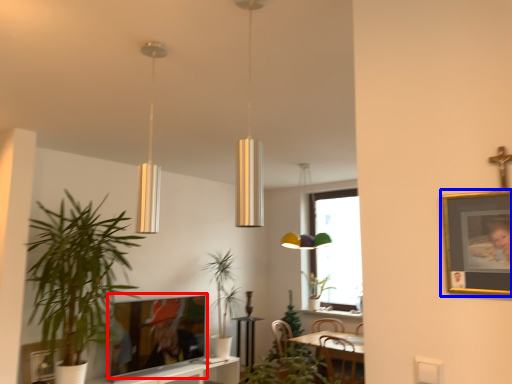
Question: Which of the following is the closest to the observer, picture frame (highlighted by a red box) or picture frame (highlighted by a blue box)?

Choices:
 (A) picture frame
 (B) picture frame

Answer: (B)